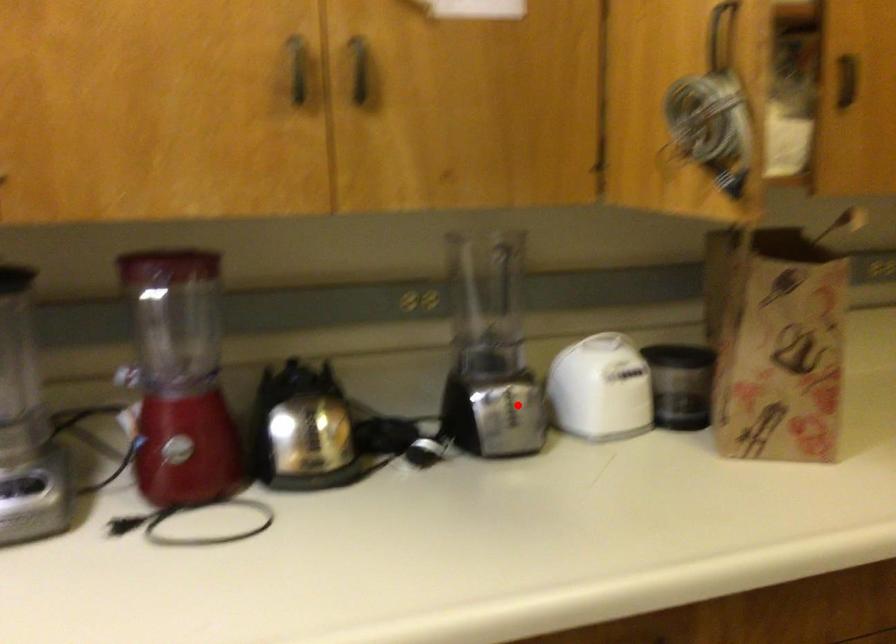
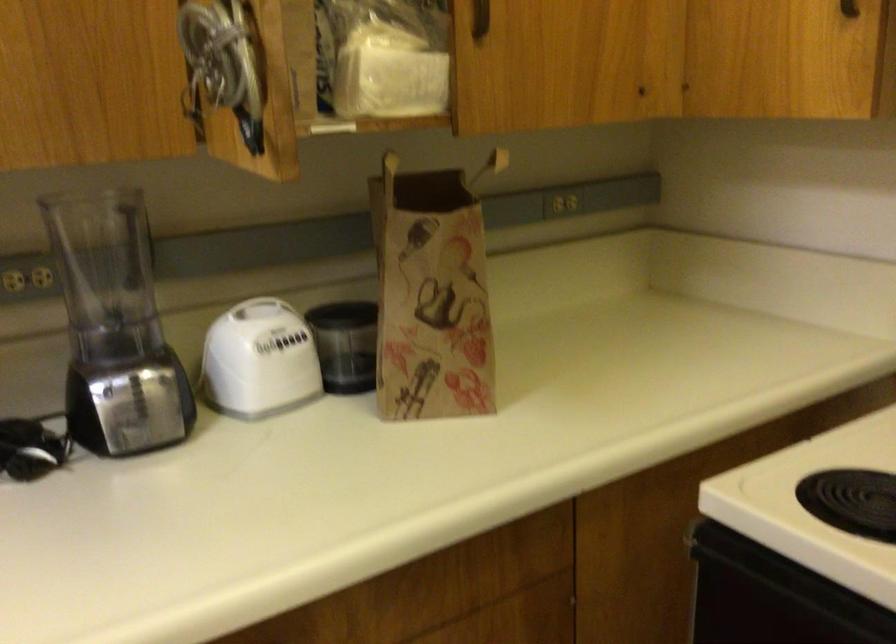
Find the pixel in the second image that matches the highlighted location in the first image.

(149, 395)